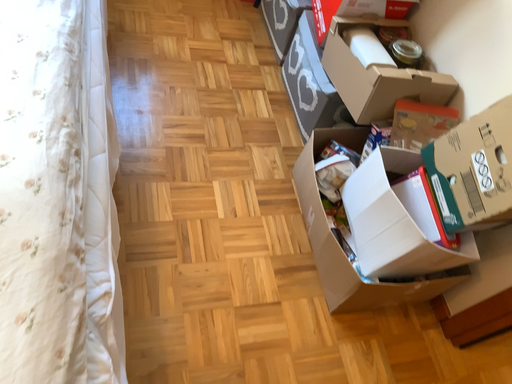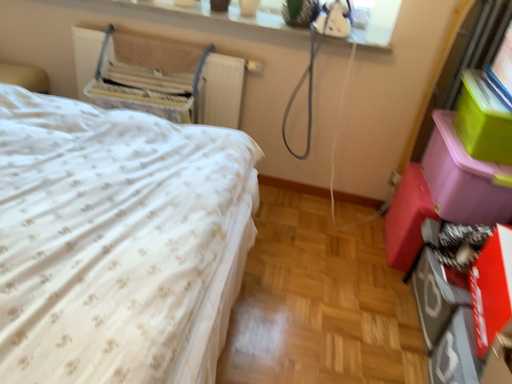
Question: How did the camera likely rotate when shooting the video?

Choices:
 (A) rotated upward
 (B) rotated downward

Answer: (A)